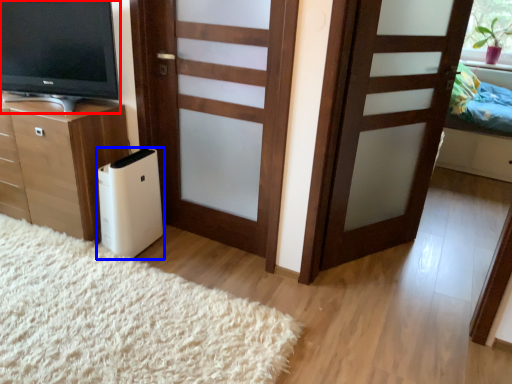
Question: Among these objects, which one is nearest to the camera, television (highlighted by a red box) or appliance (highlighted by a blue box)?

Choices:
 (A) television
 (B) appliance

Answer: (A)